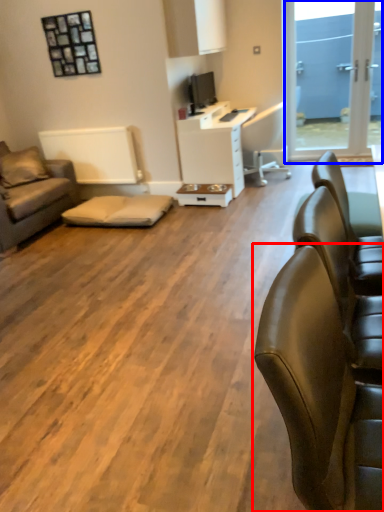
Question: Which object is closer to the camera taking this photo, chair (highlighted by a red box) or window screen (highlighted by a blue box)?

Choices:
 (A) chair
 (B) window screen

Answer: (A)